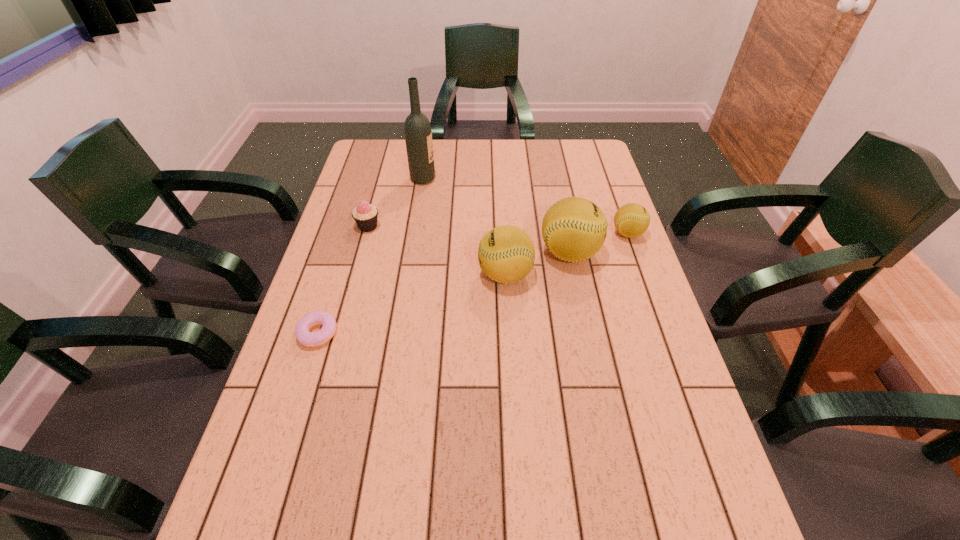
Locate an element on the screen. The image size is (960, 540). vacant space located on the logo side of the leftmost softball is located at coordinates (460, 274).

Identify the location of vacant space situated 0.250m on the logo side of the leftmost softball. (387, 274).

This screenshot has width=960, height=540. In order to click on vacant space located 0.250m on the logo side of the leftmost softball in this screenshot , I will do `click(387, 274)`.

Locate an element on the screen. The width and height of the screenshot is (960, 540). vacant region located 0.100m on the logo side of the fifth object from left to right is located at coordinates (635, 253).

The width and height of the screenshot is (960, 540). I want to click on free space located 0.260m on the labeled side of the third object from left to right, so click(x=511, y=179).

Locate an element on the screen. The image size is (960, 540). vacant region located on the back of the cupcake is located at coordinates (381, 180).

The width and height of the screenshot is (960, 540). I want to click on free space located 0.370m on the back of the doughnut, so click(352, 224).

The width and height of the screenshot is (960, 540). Identify the location of object that is at the far edge. (418, 136).

Find the location of `cupcake located in the left edge section of the desktop`. cupcake located in the left edge section of the desktop is located at coordinates (365, 215).

What are the coordinates of `doughnut situated at the left edge` in the screenshot? It's located at (310, 339).